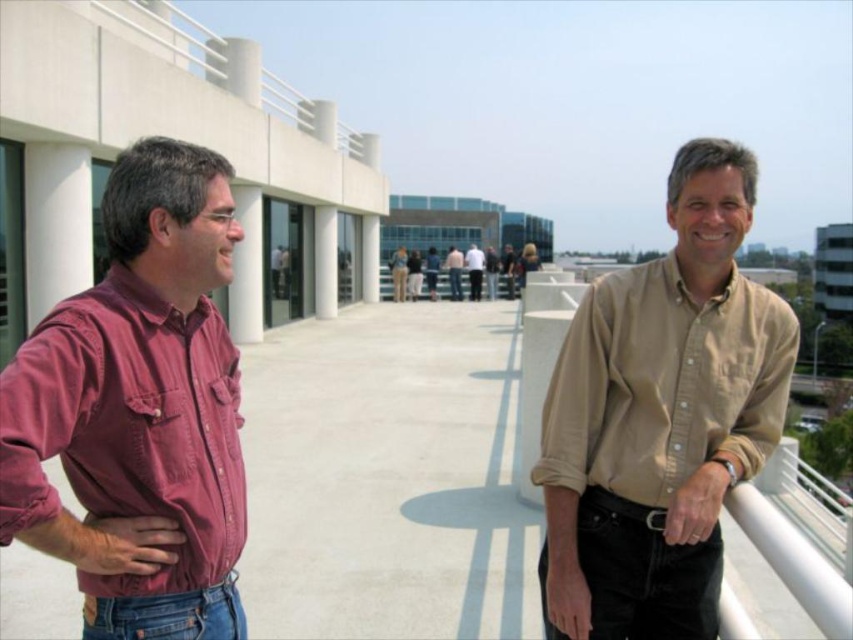
Does denim jeans at lower left appear under tan shirt at center?

Yes.

Who is more distant from viewer, (218, 586) or (450, 289)?

The point (450, 289) is more distant.

The height and width of the screenshot is (640, 853). What do you see at coordinates (167, 614) in the screenshot?
I see `denim jeans at lower left` at bounding box center [167, 614].

Find the location of `denim jeans at lower left`. denim jeans at lower left is located at coordinates (167, 614).

Can you confirm if tan shirt at center is positioned to the right of denim at center?

Indeed, tan shirt at center is positioned on the right side of denim at center.

Between point (456, 282) and point (450, 282), which one is positioned in front?

Point (456, 282) is more forward.

Where is `tan shirt at center`? The width and height of the screenshot is (853, 640). tan shirt at center is located at coordinates (454, 272).

Image resolution: width=853 pixels, height=640 pixels. What are the coordinates of `denim jeans at lower left` in the screenshot? It's located at (167, 614).

Does denim jeans at lower left have a lesser width compared to denim at center?

Indeed, denim jeans at lower left has a lesser width compared to denim at center.

Is point (97, 605) positioned in front of point (461, 291)?

That is True.

Where is `denim jeans at lower left`? The height and width of the screenshot is (640, 853). denim jeans at lower left is located at coordinates (167, 614).